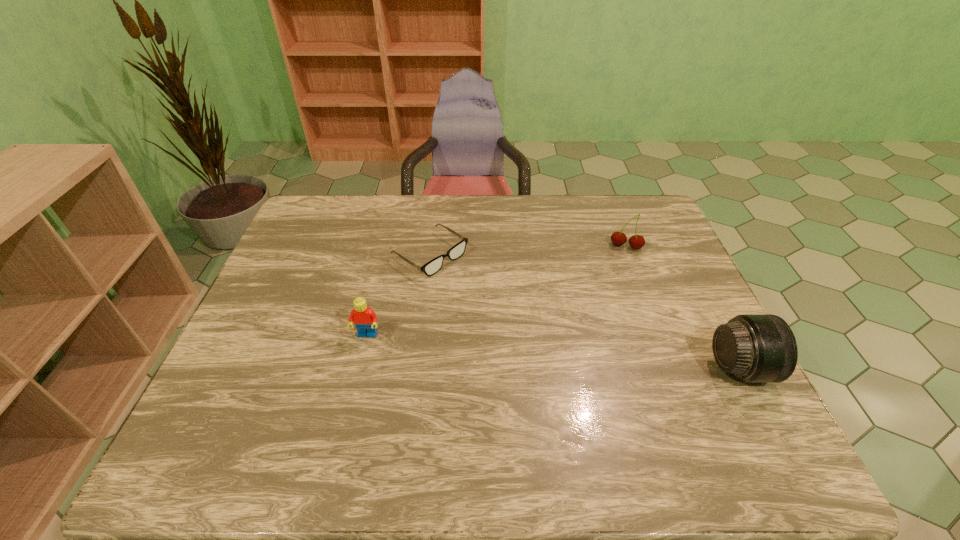
Locate an element on the screen. The height and width of the screenshot is (540, 960). the second nearest object is located at coordinates (365, 319).

This screenshot has width=960, height=540. I want to click on the nearest object, so click(x=755, y=348).

I want to click on telephoto lens, so click(755, 348).

This screenshot has width=960, height=540. What are the coordinates of `cherry` in the screenshot? It's located at (636, 241).

Find the location of `spectacles`. spectacles is located at coordinates (x=433, y=266).

Find the location of a particular element. free space located on the face of the second nearest object is located at coordinates (355, 387).

Where is `vacant space situated on the surface of the cherry`? vacant space situated on the surface of the cherry is located at coordinates (616, 275).

Identify the location of free space located on the surface of the cherry. The image size is (960, 540). (601, 335).

This screenshot has height=540, width=960. I want to click on vacant region located 0.290m on the surface of the cherry, so click(605, 319).

Image resolution: width=960 pixels, height=540 pixels. I want to click on free region located on the front-facing side of the shortest object, so click(x=501, y=300).